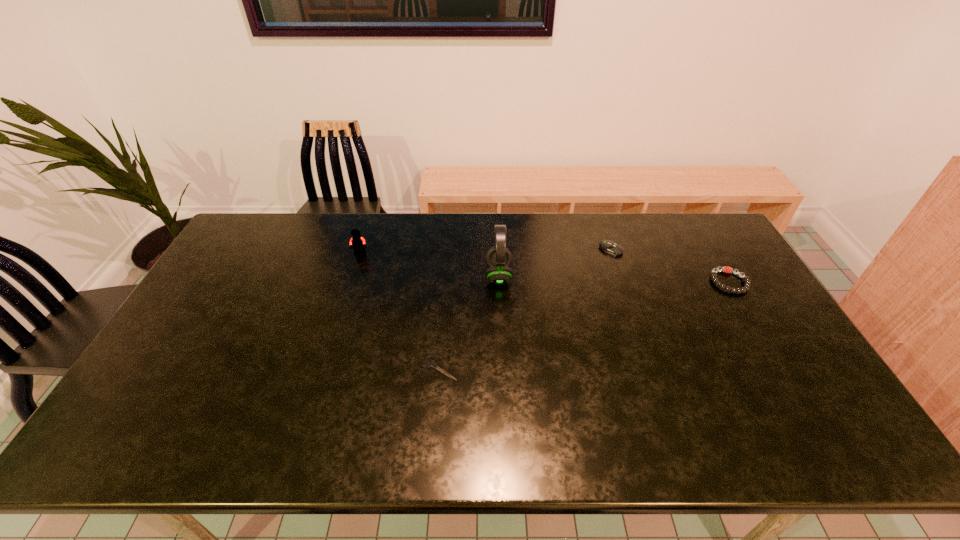
Where is `vacant area located on the ear cups of the tallest object`? vacant area located on the ear cups of the tallest object is located at coordinates (419, 275).

Find the location of a particular element. The height and width of the screenshot is (540, 960). vacant position located 0.190m on the front-facing side of the fourth shortest object is located at coordinates (347, 297).

Where is `vacant space located on the right of the computer mouse`? Image resolution: width=960 pixels, height=540 pixels. vacant space located on the right of the computer mouse is located at coordinates (675, 249).

The width and height of the screenshot is (960, 540). In order to click on vacant space situated on the front of the bracelet in this screenshot , I will do `click(763, 338)`.

Find the location of a particular element. Image resolution: width=960 pixels, height=540 pixels. vacant region located on the back of the shortest object is located at coordinates (444, 323).

Locate an element on the screen. Lego that is at the far edge is located at coordinates (357, 241).

Image resolution: width=960 pixels, height=540 pixels. What are the coordinates of `computer mouse that is at the far edge` in the screenshot? It's located at (608, 246).

The image size is (960, 540). Find the location of `object present at the right edge`. object present at the right edge is located at coordinates (747, 283).

Find the location of a particular element. vacant space at the far edge is located at coordinates (383, 237).

This screenshot has width=960, height=540. In order to click on free space at the near edge of the desktop in this screenshot , I will do `click(307, 442)`.